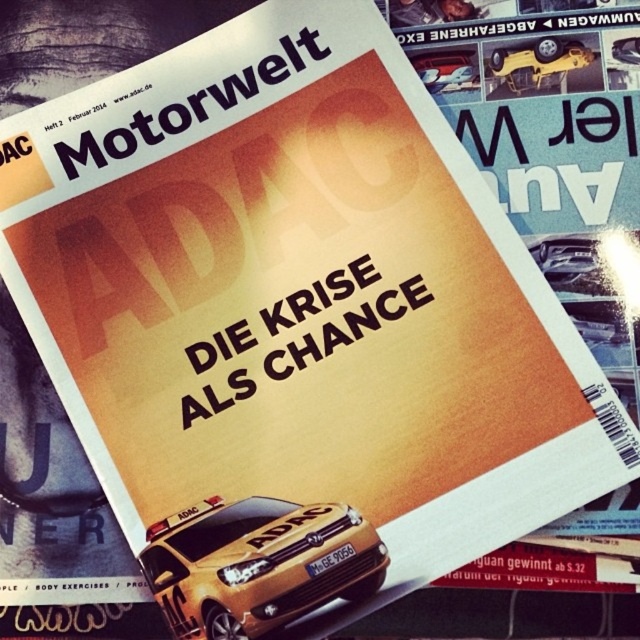
You are designing a layout for a magazine cover and need to ensure that the metallic gold car at center and the yellow matte car at upper center are positioned correctly. According to the design guidelines, the taller object should be placed lower on the page to maintain visual balance. Which car should be positioned lower?

The metallic gold car at center is taller than the yellow matte car at upper center, so it should be positioned lower on the page to maintain visual balance.

You are a graphic designer working on a layout for a magazine cover. The yellow matte car at upper center and the metallic silver car at upper center are both part of the design. Which car is placed on top of the other?

The yellow matte car at upper center is positioned over metallic silver car at upper center.

In the scene shown: You are a magazine editor reviewing the layout of the current issue. You notice the metallic gold car at center and the yellow matte car at upper center. Which car takes up more space on the cover?

The metallic gold car at center has a larger size compared to the yellow matte car at upper center, so it takes up more space on the cover.